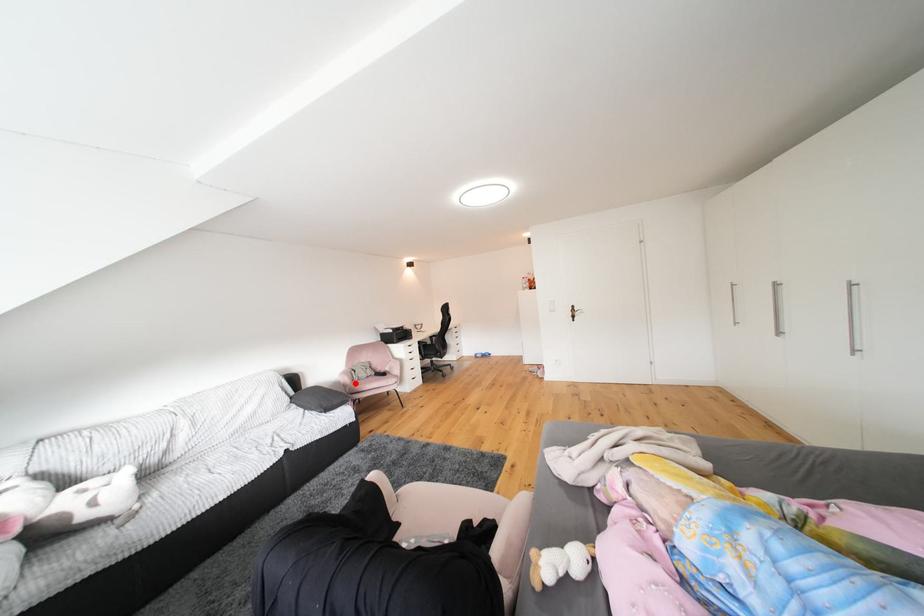
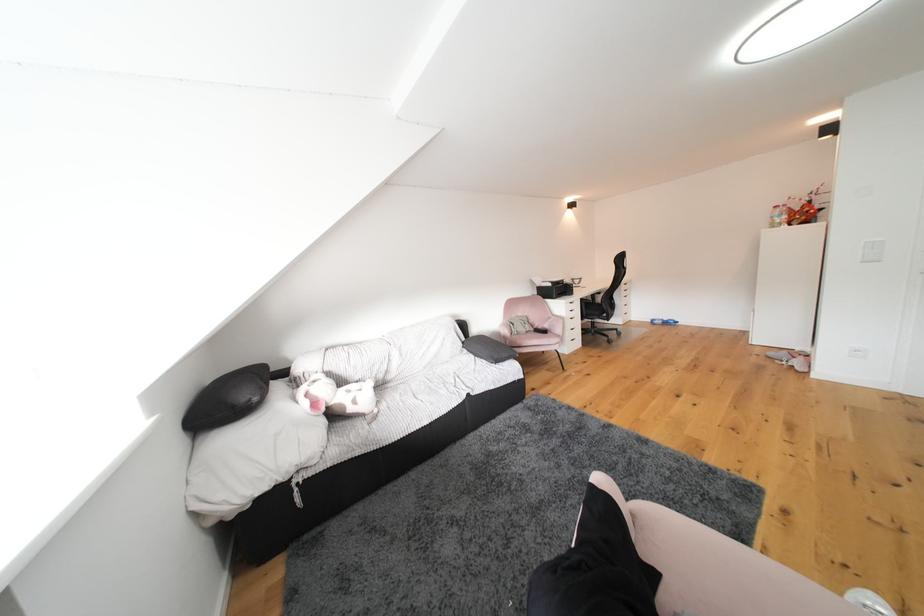
In the second image, find the point that corresponds to the highlighted location in the first image.

(515, 336)